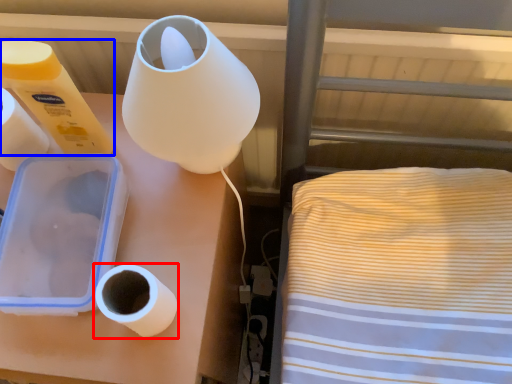
Question: Which point is further to the camera, toilet paper (highlighted by a red box) or toilet paper (highlighted by a blue box)?

Choices:
 (A) toilet paper
 (B) toilet paper

Answer: (B)